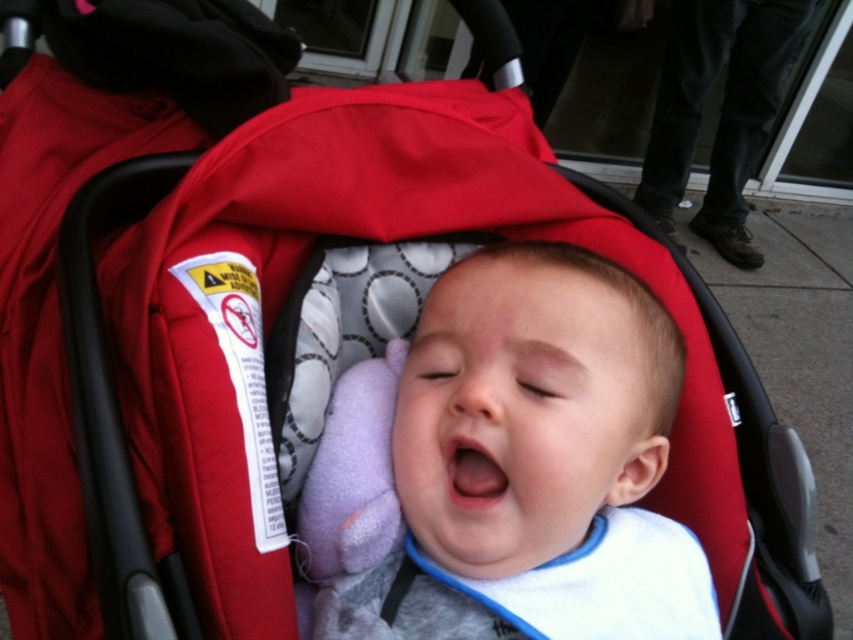
You are a photographer trying to capture a closeup of the smooth cotton baby at center and the black leather pants at upper right. Since you want both objects in focus, which one should you adjust your camera focus to prioritize? Explain your reasoning based on their positions in the image.

The smooth cotton baby at center is closer to the viewer than the black leather pants at upper right. To ensure both are in focus, the photographer should focus on the smooth cotton baby at center because it is closer, and adjusting focus for closer objects can help maintain clarity for both.

You are a photographer trying to capture a closeup of the smooth cotton baby at center and the black leather pants at upper right in the image. Since the camera can only focus on one subject at a time, which subject should you choose to ensure the smaller object is in focus?

The smooth cotton baby at center is smaller than the black leather pants at upper right, so you should focus on the smooth cotton baby at center to ensure the smaller object is in focus.